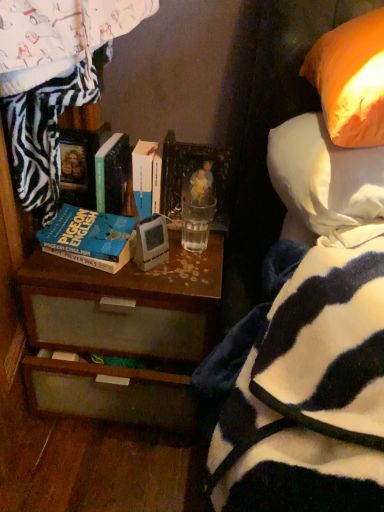
The image size is (384, 512). Describe the element at coordinates (90, 238) in the screenshot. I see `blue matte book at center left, which appears as the 1th book when viewed from the left` at that location.

The height and width of the screenshot is (512, 384). Find the location of `hardcover book at center, which is counted as the second book, starting from the left`. hardcover book at center, which is counted as the second book, starting from the left is located at coordinates (112, 174).

This screenshot has height=512, width=384. Describe the element at coordinates (143, 176) in the screenshot. I see `white matte book at center, the third book positioned from the left` at that location.

The image size is (384, 512). Identify the location of blue matte book at center left, which appears as the 1th book when viewed from the left. (90, 238).

Is brown wood desk at center far from white matte book at center, the third book positioned from the left?

No, brown wood desk at center is not far away from white matte book at center, the third book positioned from the left.

Which of these two, brown wood desk at center or white matte book at center, the first book when ordered from right to left, is thinner?

Thinner between the two is white matte book at center, the first book when ordered from right to left.

Considering the relative sizes of brown wood desk at center and white matte book at center, the first book when ordered from right to left, in the image provided, is brown wood desk at center bigger than white matte book at center, the first book when ordered from right to left,?

Correct, brown wood desk at center is larger in size than white matte book at center, the first book when ordered from right to left.

Is brown wood desk at center completely or partially outside of white matte book at center, the third book positioned from the left?

Absolutely, brown wood desk at center is external to white matte book at center, the third book positioned from the left.

Is the surface of clear glass at center in direct contact with orange fabric pillow at upper right?

There is a gap between clear glass at center and orange fabric pillow at upper right.

From the picture: Is clear glass at center shorter than orange fabric pillow at upper right?

Correct, clear glass at center is not as tall as orange fabric pillow at upper right.

From the image's perspective, is clear glass at center above or below orange fabric pillow at upper right?

Clearly, from the image's perspective, clear glass at center is below orange fabric pillow at upper right.

Looking at this image, in terms of width, does clear glass at center look wider or thinner when compared to orange fabric pillow at upper right?

Clearly, clear glass at center has less width compared to orange fabric pillow at upper right.

Does matte plastic picture frame at upper center contain blue matte book at center left, the 3th book viewed from the right?

No, matte plastic picture frame at upper center does not contain blue matte book at center left, the 3th book viewed from the right.

From a real-world perspective, which object rests below the other?

blue matte book at center left, which appears as the 1th book when viewed from the left.

Which object is closer to the camera, matte plastic picture frame at upper center or blue matte book at center left, which appears as the 1th book when viewed from the left?

Positioned in front is blue matte book at center left, which appears as the 1th book when viewed from the left.

Is matte plastic picture frame at upper center directly adjacent to blue matte book at center left, which appears as the 1th book when viewed from the left?

No, matte plastic picture frame at upper center is not touching blue matte book at center left, which appears as the 1th book when viewed from the left.

Is blue matte book at center left, which appears as the 1th book when viewed from the left, positioned with its back to matte plastic picture frame at upper center?

No, blue matte book at center left, which appears as the 1th book when viewed from the left,'s orientation is not away from matte plastic picture frame at upper center.

Can you confirm if blue matte book at center left, the 3th book viewed from the right, is positioned to the right of matte plastic picture frame at upper center?

No.

Considering the relative sizes of blue matte book at center left, which appears as the 1th book when viewed from the left, and matte plastic picture frame at upper center in the image provided, is blue matte book at center left, which appears as the 1th book when viewed from the left, bigger than matte plastic picture frame at upper center?

Indeed, blue matte book at center left, which appears as the 1th book when viewed from the left, has a larger size compared to matte plastic picture frame at upper center.

From the image's perspective, is blue matte book at center left, the 3th book viewed from the right, located beneath matte plastic picture frame at upper center?

Correct, blue matte book at center left, the 3th book viewed from the right, appears lower than matte plastic picture frame at upper center in the image.

From a real-world perspective, count 1st books downward from the hardcover book at center, which is counted as the second book, starting from the left, and point to it. Please provide its 2D coordinates.

[(143, 176)]

From the image's perspective, between hardcover book at center, the second book from the right, and white matte book at center, the first book when ordered from right to left, who is located below?

white matte book at center, the first book when ordered from right to left, from the image's perspective.

Which object is positioned more to the left, hardcover book at center, which is counted as the second book, starting from the left, or white matte book at center, the first book when ordered from right to left?

From the viewer's perspective, hardcover book at center, which is counted as the second book, starting from the left, appears more on the left side.

Based on the photo, considering the sizes of matte plastic picture frame at upper center and clear glass at center in the image, is matte plastic picture frame at upper center wider or thinner than clear glass at center?

Considering their sizes, matte plastic picture frame at upper center looks slimmer than clear glass at center.

Does matte plastic picture frame at upper center lie in front of clear glass at center?

No, matte plastic picture frame at upper center is behind clear glass at center.

Which is closer to the camera, (214, 149) or (191, 245)?

Clearly, point (214, 149) is more distant from the camera than point (191, 245).

From a real-world perspective, who is located lower, matte plastic picture frame at upper center or clear glass at center?

In real-world perspective, clear glass at center is lower.

Would you say hardcover book at center, which is counted as the second book, starting from the left, is outside brown wood desk at center?

Yes, hardcover book at center, which is counted as the second book, starting from the left, is located beyond the bounds of brown wood desk at center.

How different are the orientations of hardcover book at center, which is counted as the second book, starting from the left, and brown wood desk at center in degrees?

There is a 0.000455-degree angle between the facing directions of hardcover book at center, which is counted as the second book, starting from the left, and brown wood desk at center.

Is hardcover book at center, the second book from the right, positioned before brown wood desk at center?

No.

From the image's perspective, is hardcover book at center, which is counted as the second book, starting from the left, on top of brown wood desk at center?

Yes, from the image's perspective, hardcover book at center, which is counted as the second book, starting from the left, is above brown wood desk at center.

I want to click on book lying on the right of brown wood desk at center, so click(x=143, y=176).

This screenshot has height=512, width=384. In order to click on pillow that is in front of the clear glass at center in this screenshot , I will do coord(325,184).

Estimate the real-world distances between objects in this image. Which object is closer to brown wood desk at center, white matte book at center, the third book positioned from the left, or clear glass at center?

clear glass at center lies closer to brown wood desk at center than the other object.

From the image, which object appears to be nearer to white matte book at center, the third book positioned from the left, matte plastic picture frame at upper center or clear glass at center?

matte plastic picture frame at upper center is positioned closer to the anchor white matte book at center, the third book positioned from the left.

Looking at this image, estimate the real-world distances between objects in this image. Which object is further from blue matte book at center left, which appears as the 1th book when viewed from the left, brown wood desk at center or clear glass at center?

clear glass at center is positioned further to the anchor blue matte book at center left, which appears as the 1th book when viewed from the left.

Based on their spatial positions, is white matte book at center, the first book when ordered from right to left, or hardcover book at center, which is counted as the second book, starting from the left, further from clear glass at center?

hardcover book at center, which is counted as the second book, starting from the left.

Which object lies nearer to the anchor point hardcover book at center, the second book from the right, blue matte book at center left, the 3th book viewed from the right, or orange fabric pillow at upper right?

The object closer to hardcover book at center, the second book from the right, is blue matte book at center left, the 3th book viewed from the right.

When comparing their distances from orange fabric pillow at upper right, does blue matte book at center left, the 3th book viewed from the right, or hardcover book at center, which is counted as the second book, starting from the left, seem further?

Based on the image, hardcover book at center, which is counted as the second book, starting from the left, appears to be further to orange fabric pillow at upper right.

Based on their spatial positions, is white matte book at center, the first book when ordered from right to left, or clear glass at center further from hardcover book at center, the second book from the right?

The object further to hardcover book at center, the second book from the right, is clear glass at center.

Considering their positions, is clear glass at center positioned further to blue matte book at center left, the 3th book viewed from the right, than brown wood desk at center?

clear glass at center is positioned further to the anchor blue matte book at center left, the 3th book viewed from the right.

This screenshot has height=512, width=384. I want to click on book between hardcover book at center, the second book from the right, and orange fabric pillow at upper right, in the horizontal direction, so click(x=143, y=176).

Identify the location of picture frame between white matte book at center, the third book positioned from the left, and clear glass at center, in the vertical direction. The height and width of the screenshot is (512, 384). (193, 178).

At what (x,y) coordinates should I click in order to perform the action: click on desk between orange fabric pillow at upper right and matte plastic picture frame at upper center in the front-back direction. Please return your answer as a coordinate pair (x, y). Looking at the image, I should click on (126, 305).

Image resolution: width=384 pixels, height=512 pixels. I want to click on coffee cup between orange fabric pillow at upper right and matte plastic picture frame at upper center in the front-back direction, so click(x=197, y=223).